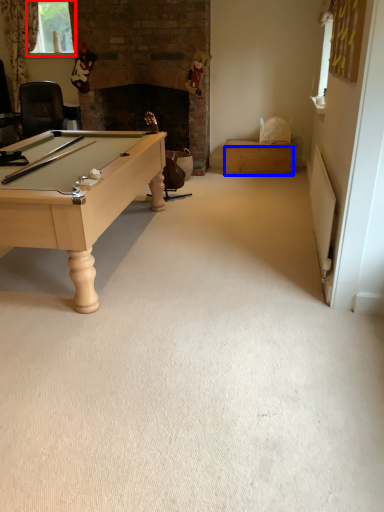
Question: Which point is closer to the camera, window screen (highlighted by a red box) or drawer (highlighted by a blue box)?

Choices:
 (A) window screen
 (B) drawer

Answer: (B)